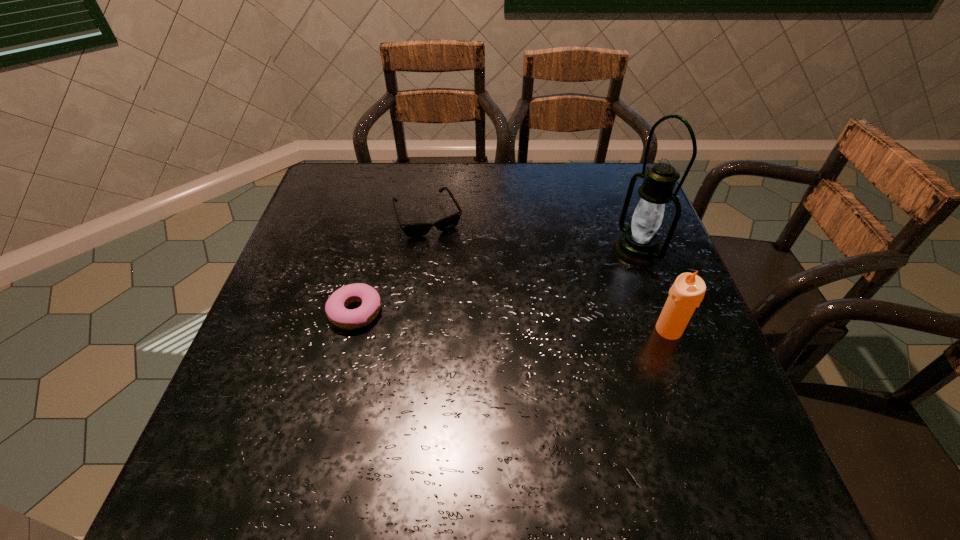
This screenshot has width=960, height=540. In order to click on doughnut in this screenshot , I will do `click(335, 308)`.

Identify the location of candle. The width and height of the screenshot is (960, 540). [687, 292].

I want to click on the tallest object, so click(x=638, y=245).

The image size is (960, 540). What are the coordinates of `the second shortest object` in the screenshot? It's located at (412, 230).

You are a GUI agent. You are given a task and a screenshot of the screen. Output one action in this format:
    pyautogui.click(x=<x>, y=<y>)
    Task: Click on the vacant space situated on the back of the doughnut
    
    Given the screenshot: What is the action you would take?
    pyautogui.click(x=375, y=235)

Identify the location of vacant area situated 0.120m on the front of the candle. (692, 394).

This screenshot has height=540, width=960. Identify the location of vacant space located on the side where the tallest object emits light. (568, 279).

In order to click on free space located on the side where the tallest object emits light in this screenshot , I will do `click(546, 288)`.

Identify the location of free location located 0.100m on the side where the tallest object emits light. The image size is (960, 540). pyautogui.click(x=586, y=272).

Find the location of a particular element. The image size is (960, 540). vacant space located 0.180m on the front-facing side of the sunglasses is located at coordinates (461, 287).